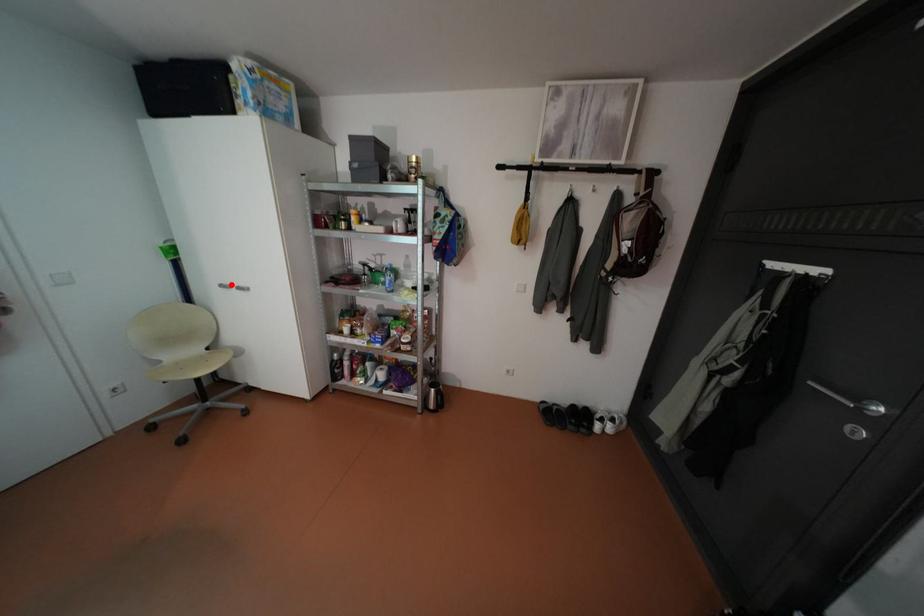
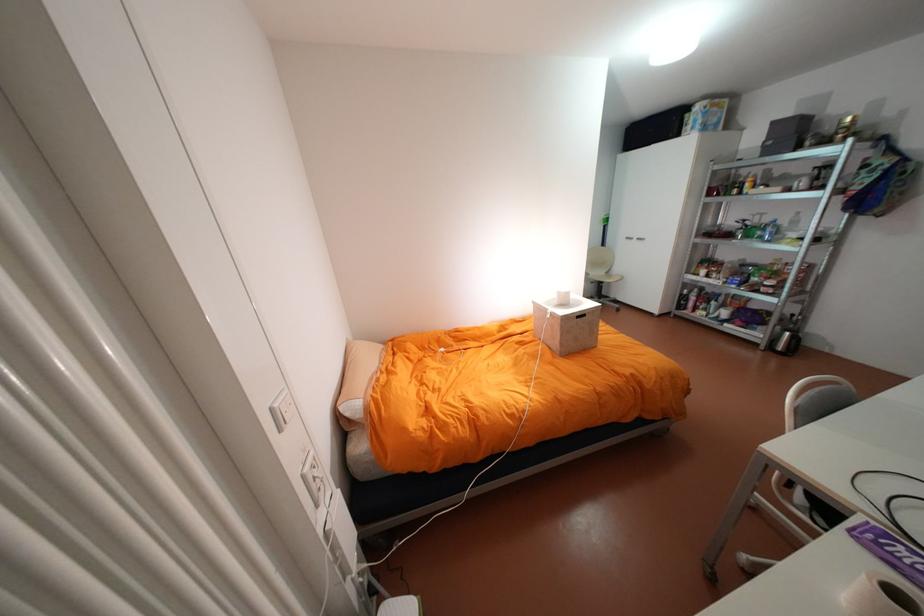
Question: I am providing you with two images of the same scene from different viewpoints. A red point is marked on the first image. Can you still see the location of the red point in image 2?

Choices:
 (A) Yes
 (B) No

Answer: (A)